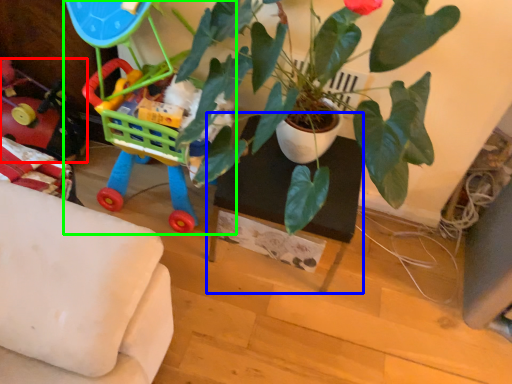
Question: Estimate the real-world distances between objects in this image. Which object is closer to toy (highlighted by a red box), table (highlighted by a blue box) or toy (highlighted by a green box)?

Choices:
 (A) table
 (B) toy

Answer: (B)